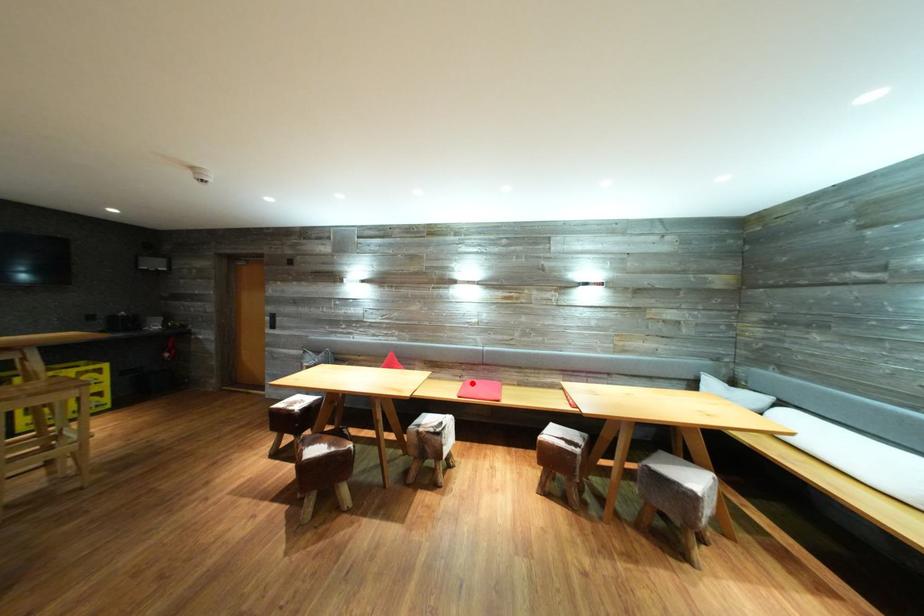
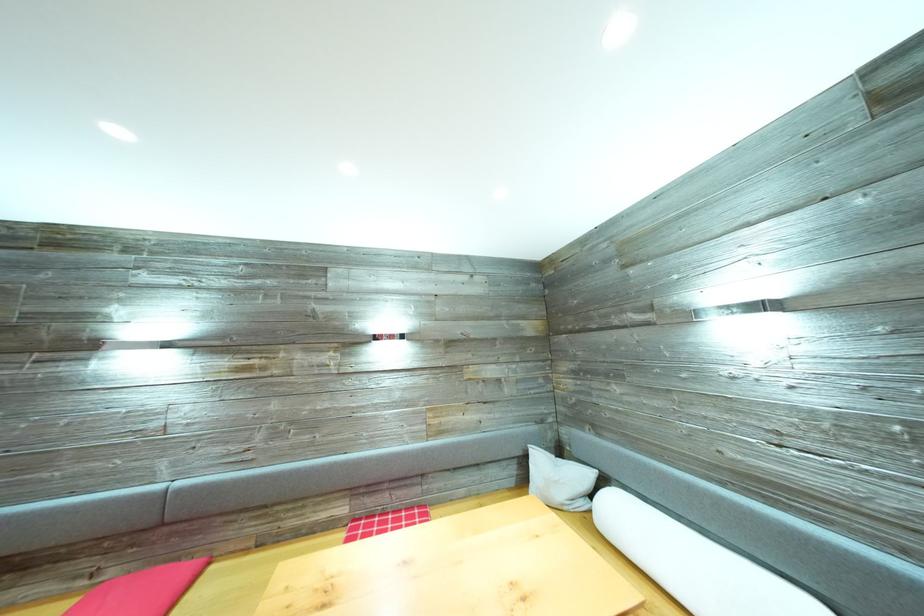
Question: I am providing you with two images of the same scene from different viewpoints. A red point is marked on the first image. Can you still see the location of the red point in image 2?

Choices:
 (A) Yes
 (B) No

Answer: (A)